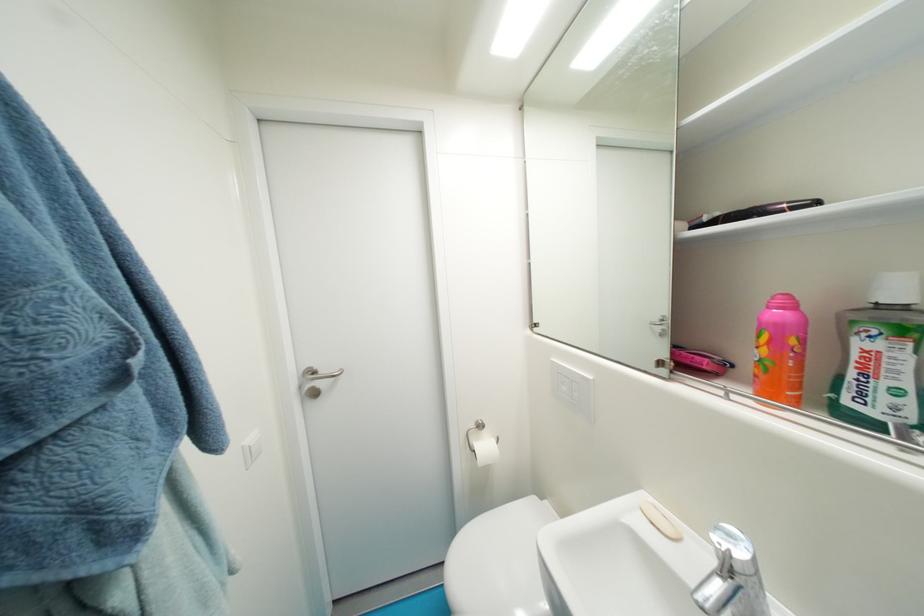
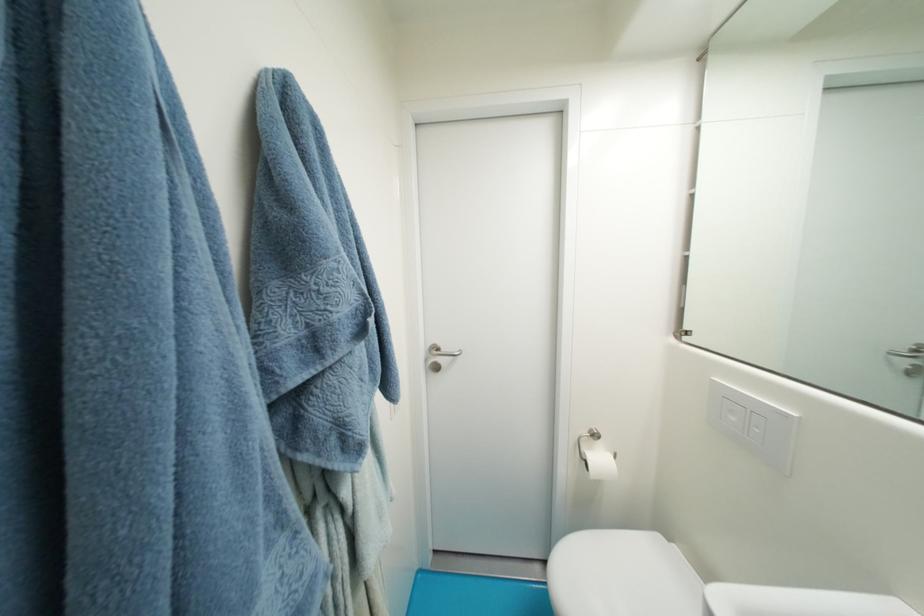
Question: Which direction would the cameraman need to move to produce the second image? Reply with the corresponding letter.

Choices:
 (A) Left
 (B) Right
 (C) Forward
 (D) Backward

Answer: (A)